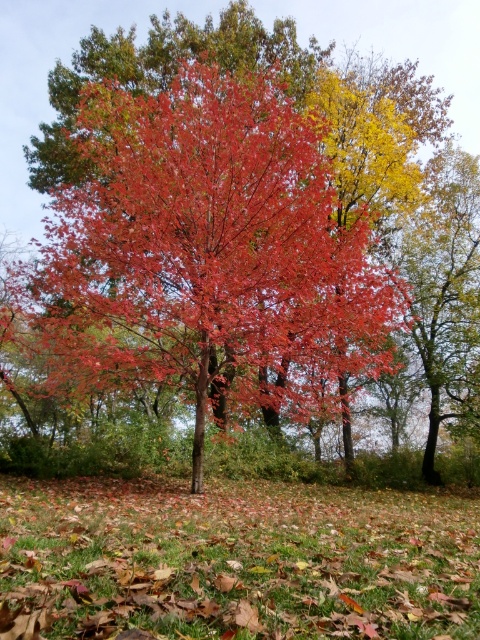
You are a gardener who wants to plant a new flower bed between the shiny red maple tree at center and the brown grass at lower center. Considering their sizes, which object would you need to consider for space availability?

The shiny red maple tree at center is much taller than the brown grass at lower center, so you should consider the space required for the tree when planning the flower bed.

You are standing at the center of the image and want to walk towards the shiny red maple tree at center. Which direction should you move?

Since the shiny red maple tree at center is already at the center of the image, you don not need to move in any direction to reach it. You are already facing the tree.